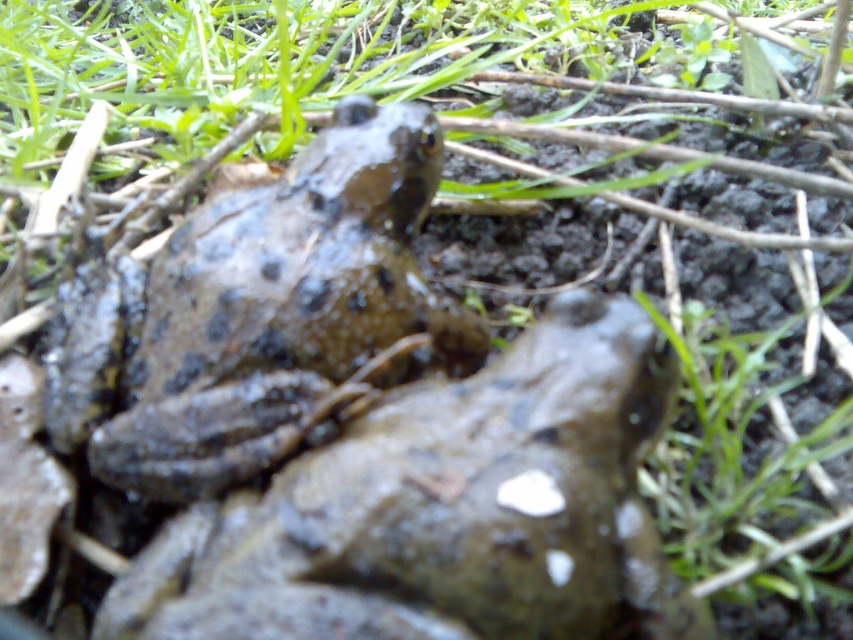
Which of these two, speckled mud frog at center or muddy skin frog at center, stands taller?

muddy skin frog at center

Does point (474, 557) come in front of point (379, 182)?

Yes.

Between point (421, 582) and point (405, 148), which one is positioned in front?

Positioned in front is point (421, 582).

This screenshot has height=640, width=853. I want to click on speckled mud frog at center, so click(x=445, y=512).